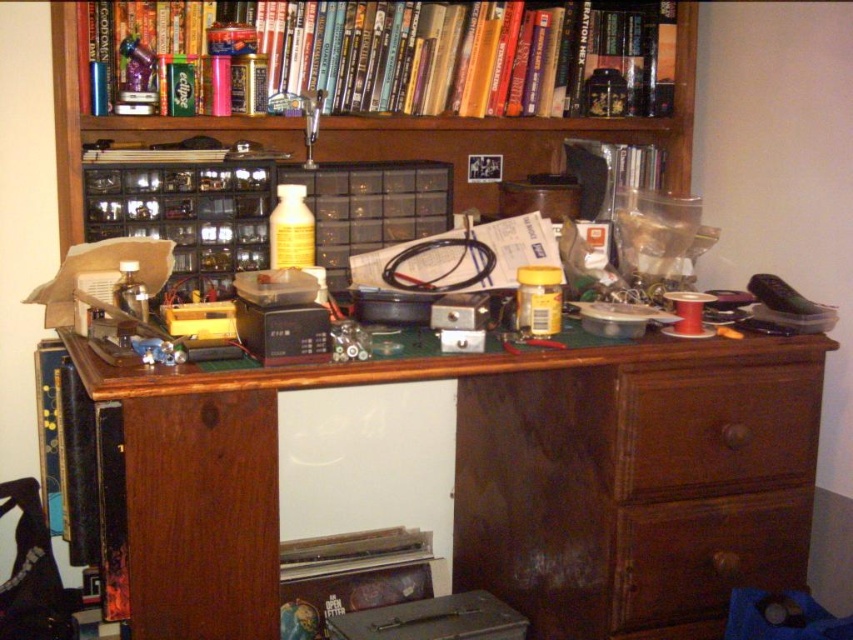
Question: Which object is the farthest from the wooden drawer at lower right?

Choices:
 (A) brown wood drawer at right
 (B) yellow matte bottle at center
 (C) wooden desk at center

Answer: (B)

Question: Among these points, which one is farthest from the camera?

Choices:
 (A) (589, 118)
 (B) (737, 484)
 (C) (701, 504)

Answer: (A)

Question: Among these objects, which one is farthest from the camera?

Choices:
 (A) wooden desk at center
 (B) wooden drawer at lower right
 (C) wooden bookcase at upper center

Answer: (B)

Question: Can you confirm if wooden bookcase at upper center is wider than wooden drawer at lower right?

Choices:
 (A) no
 (B) yes

Answer: (B)

Question: Is wooden desk at center in front of wooden drawer at lower right?

Choices:
 (A) yes
 (B) no

Answer: (A)

Question: Where is hardcover book at upper center located in relation to brown wood drawer at right in the image?

Choices:
 (A) below
 (B) above

Answer: (B)